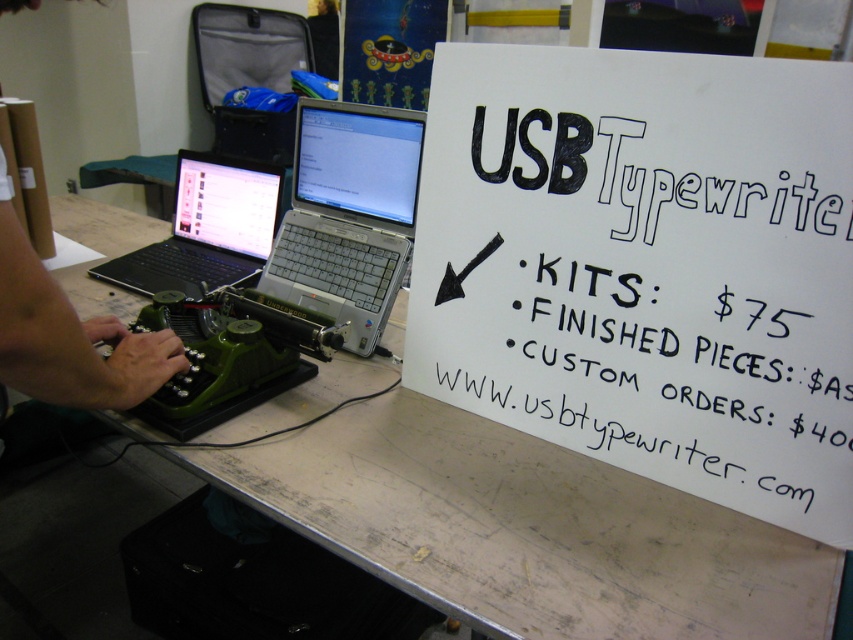
Question: Which object appears closest to the camera in this image?

Choices:
 (A) green plastic typewriter at left
 (B) white paper sign at upper right
 (C) silver metallic laptop at center

Answer: (A)

Question: Where is silver metallic laptop at center located in relation to satin black laptop at center in the image?

Choices:
 (A) right
 (B) left

Answer: (A)

Question: Which point appears closest to the camera in this image?

Choices:
 (A) (352, 410)
 (B) (149, 276)
 (C) (647, 140)
 (D) (344, 342)

Answer: (C)

Question: From the image, what is the correct spatial relationship of white paper sign at upper right in relation to green plastic typewriter at left?

Choices:
 (A) above
 (B) below

Answer: (A)

Question: Is white paper sign at upper right above satin black laptop at center?

Choices:
 (A) no
 (B) yes

Answer: (A)

Question: Which of the following is the closest to the observer?

Choices:
 (A) (340, 497)
 (B) (146, 250)

Answer: (A)